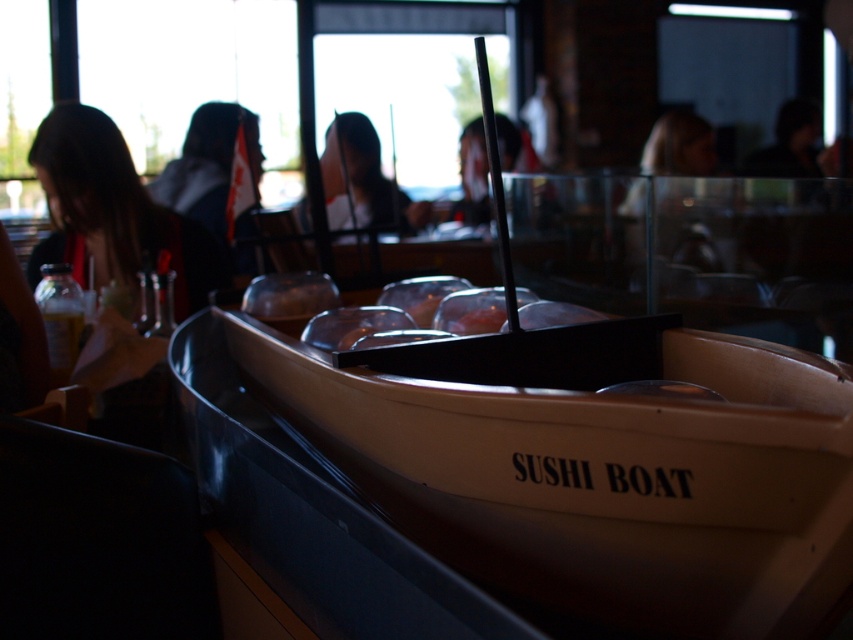
Question: Can you confirm if dark brown hair at left is positioned to the left of smooth black hair at center?

Choices:
 (A) no
 (B) yes

Answer: (B)

Question: Which of the following is the closest to the observer?

Choices:
 (A) dark brown hair at left
 (B) smooth white shirt at center
 (C) wooden sushi boat at center
 (D) smooth black hair at center

Answer: (C)

Question: Considering the relative positions of wooden sushi boat at center and smooth white shirt at center in the image provided, where is wooden sushi boat at center located with respect to smooth white shirt at center?

Choices:
 (A) left
 (B) right

Answer: (B)

Question: Among these objects, which one is nearest to the camera?

Choices:
 (A) smooth white shirt at center
 (B) smooth black hair at center
 (C) dark brown hair at left
 (D) wooden sushi boat at center

Answer: (D)

Question: Does dark brown hair at left have a lesser width compared to smooth white shirt at center?

Choices:
 (A) yes
 (B) no

Answer: (B)

Question: Which point is farther to the camera?

Choices:
 (A) smooth white shirt at center
 (B) wooden sushi boat at center

Answer: (A)